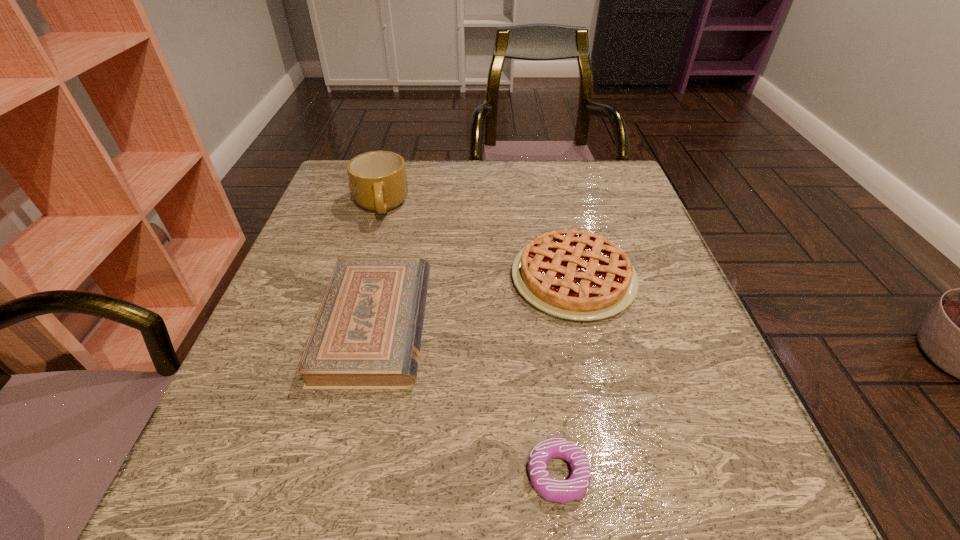
Locate an element on the screen. The width and height of the screenshot is (960, 540). vacant area at the far right corner is located at coordinates (571, 190).

The image size is (960, 540). Identify the location of blank region between the farthest object and the shortest object. (469, 341).

What are the coordinates of `unoccupied position between the tallest object and the pie` in the screenshot? It's located at (477, 242).

Find the location of a particular element. The image size is (960, 540). empty space that is in between the tallest object and the shortest object is located at coordinates (469, 341).

Where is `free point between the nearest object and the Bible`? This screenshot has height=540, width=960. free point between the nearest object and the Bible is located at coordinates (467, 400).

Identify the location of vacant space that's between the Bible and the shortest object. The width and height of the screenshot is (960, 540). (467, 400).

At what (x,y) coordinates should I click in order to perform the action: click on vacant space that's between the pie and the Bible. Please return your answer as a coordinate pair (x, y). Image resolution: width=960 pixels, height=540 pixels. Looking at the image, I should click on (474, 301).

At what (x,y) coordinates should I click in order to perform the action: click on vacant area that lies between the pie and the tallest object. Please return your answer as a coordinate pair (x, y). Image resolution: width=960 pixels, height=540 pixels. Looking at the image, I should click on (477, 242).

Where is `vacant region between the Bible and the shortest object`? The width and height of the screenshot is (960, 540). vacant region between the Bible and the shortest object is located at coordinates (467, 400).

This screenshot has height=540, width=960. I want to click on vacant space in between the mug and the pie, so click(x=477, y=242).